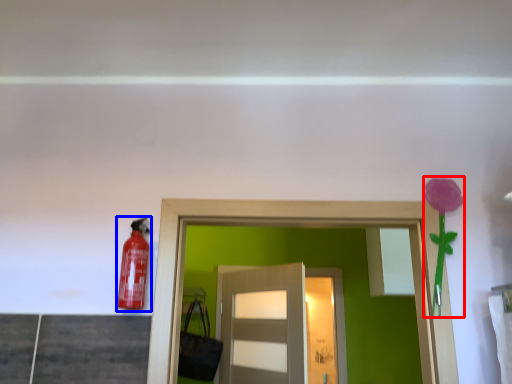
Question: Among these objects, which one is farthest to the camera, flower (highlighted by a red box) or extinguisher (highlighted by a blue box)?

Choices:
 (A) flower
 (B) extinguisher

Answer: (A)